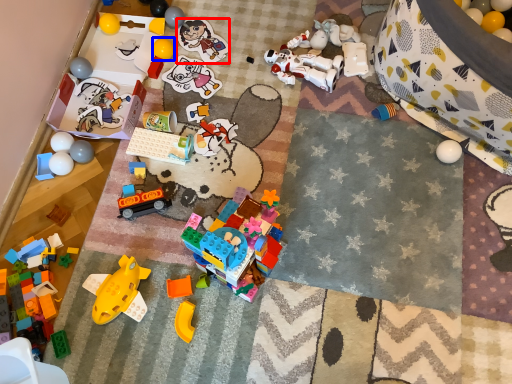
Question: Which of the following is the closest to the observer, toy (highlighted by a red box) or toy (highlighted by a blue box)?

Choices:
 (A) toy
 (B) toy

Answer: (B)